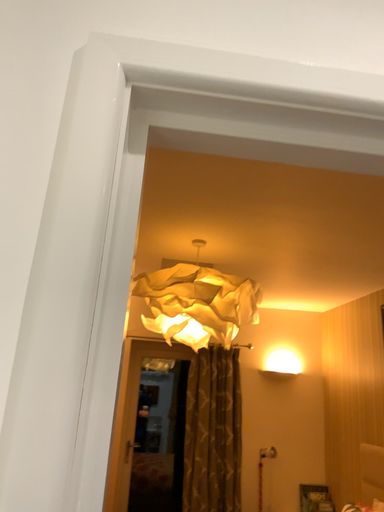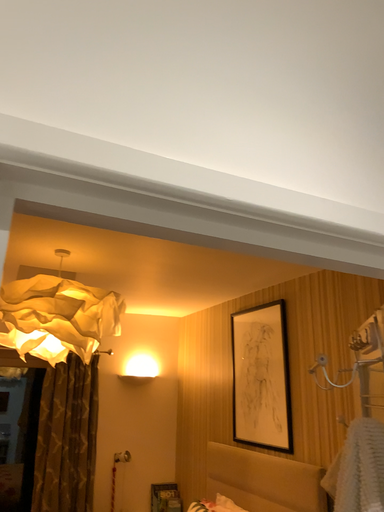
Question: How did the camera likely rotate when shooting the video?

Choices:
 (A) rotated right
 (B) rotated left

Answer: (A)